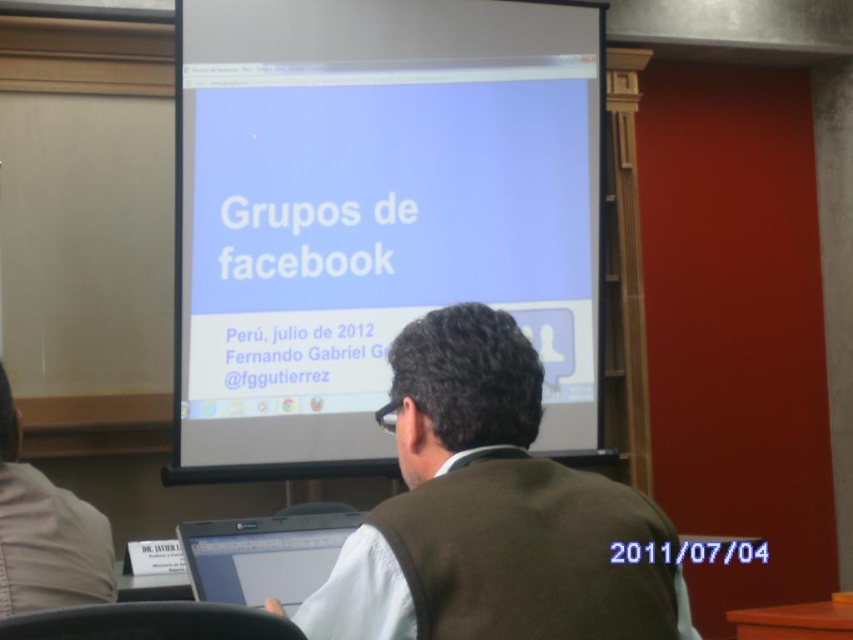
You are an attendee at the presentation and want to take a photo of the white glossy projector screen at center and the brown woolen vest at center. Since you can only focus on one object at a time, which one should you aim your camera at first to ensure the other is still in frame?

The white glossy projector screen at center is to the left of brown woolen vest at center, so you should aim your camera at the white glossy projector screen at center first. This way, the brown woolen vest at center will remain in the frame to its right.

You are standing in the conference room and want to place a new object exactly where the brown woolen vest at center is located. What are the coordinates of that location?

The coordinates of the location where the brown woolen vest at center is located are at point (489,512).

You are setting up for a presentation and need to place a 3.5 feet wide banner between the white glossy projector screen at center and the silver metallic laptop at lower center. Can the banner fit without overlapping either object?

The distance between the white glossy projector screen at center and the silver metallic laptop at lower center is 5.00 feet. Since the banner is 3.5 feet wide, it can fit between them as 3.5 feet is less than 5.00 feet, leaving space on both sides.